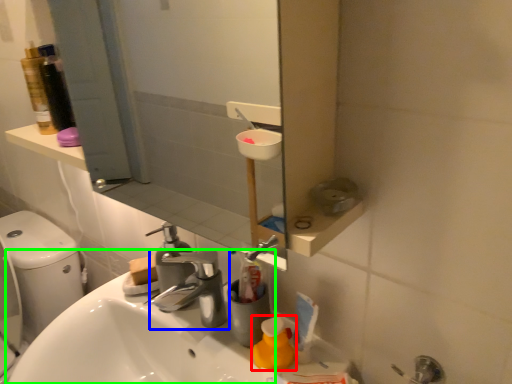
Question: Considering the real-world distances, which object is closest to cleaning product (highlighted by a red box)? tap (highlighted by a blue box) or sink (highlighted by a green box).

Choices:
 (A) tap
 (B) sink

Answer: (A)